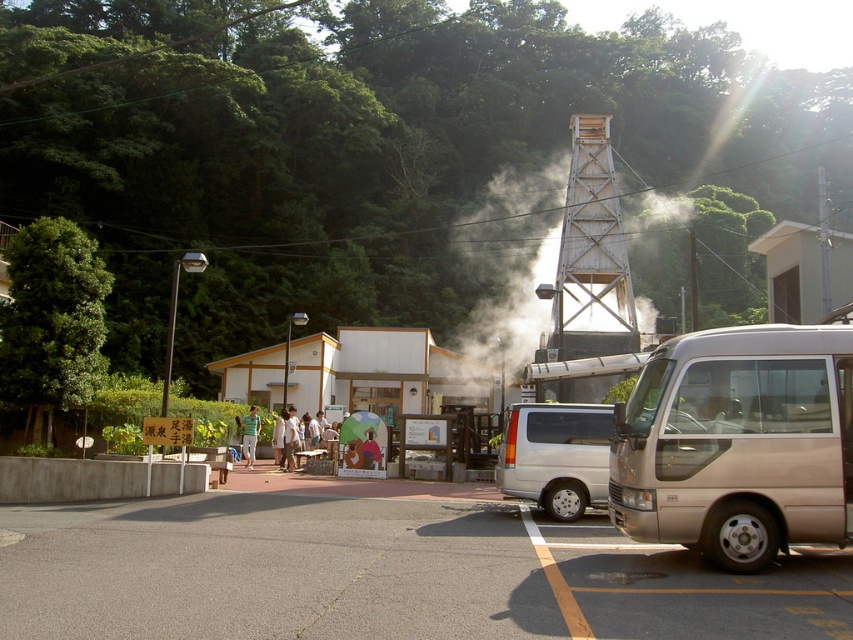
Based on the scene description, where exactly is the white smoke at center located in terms of coordinates?

The white smoke at center is located at coordinates point (592, 252).

You are a maintenance worker who needs to reach the wooden lattice tower at center from the parking area. There is white smoke at center coming from a vent nearby. If the safety protocol requires staying at least 5 meters away from any smoke emission, are you compliant with the protocol when approaching the tower?

The distance between the white smoke at center and the wooden lattice tower at center is 4.27 meters. Since the required safety distance is 5 meters, approaching the tower would mean you are within 4.27 meters of the smoke, which is less than the required 5 meters. Therefore, you are not compliant with the safety protocol.